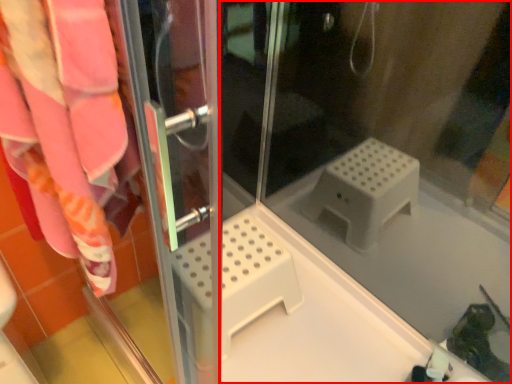
Question: From the image's perspective, what is the correct spatial relationship of glass door (annotated by the red box) in relation to screen door?

Choices:
 (A) below
 (B) above

Answer: (B)